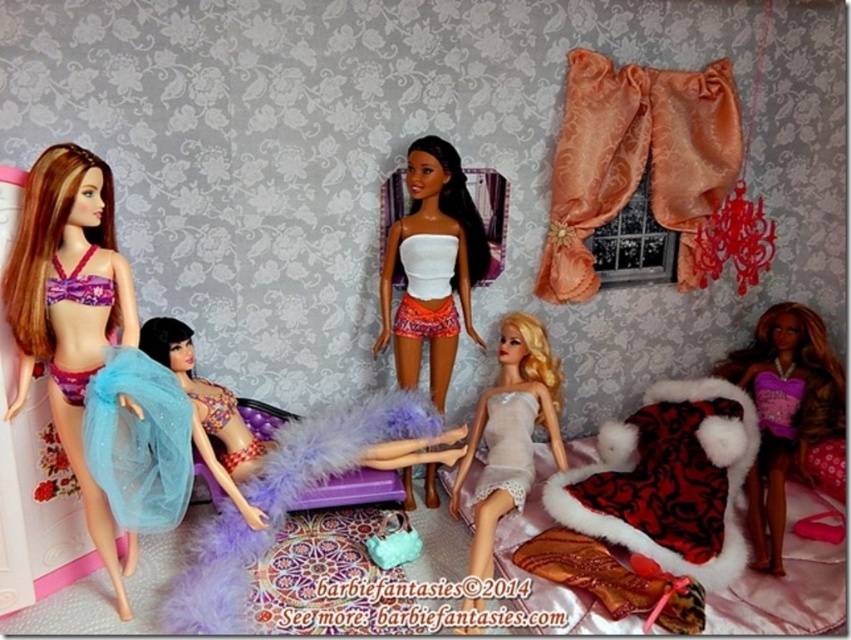
You are a photographer setting up a shoot in this dollhouse bedroom. You need to place a spotlight exactly at the point marked by coordinates point (510, 432). What object will the spotlight illuminate?

The spotlight placed at point (510, 432) will illuminate the white satin dress at center.

You are a dollhouse designer arranging the dolls in the bedroom scene. You notice the white satin dress at center and the translucent blue fabric at center. Which object is positioned lower in the scene?

The white satin dress at center is located below the translucent blue fabric at center, so it is positioned lower in the scene.